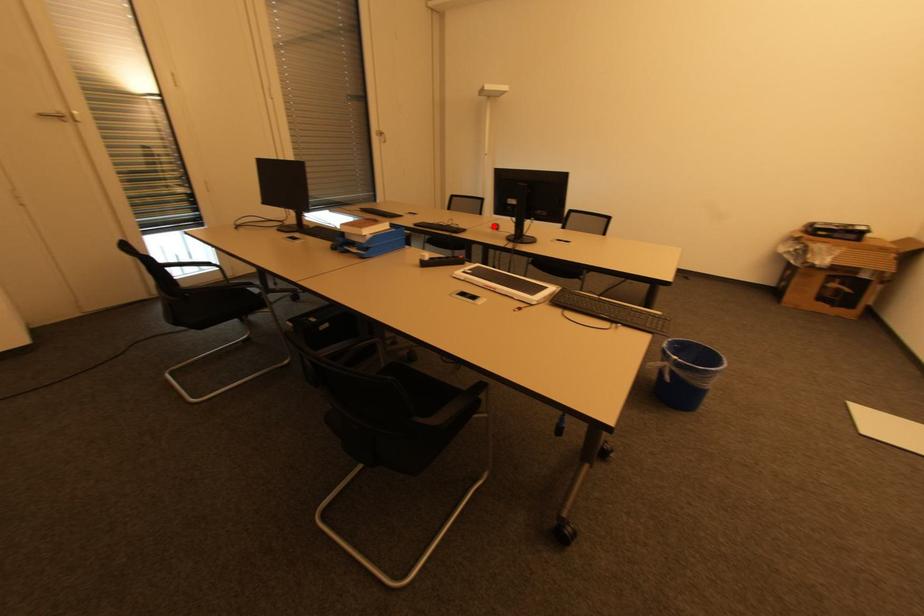
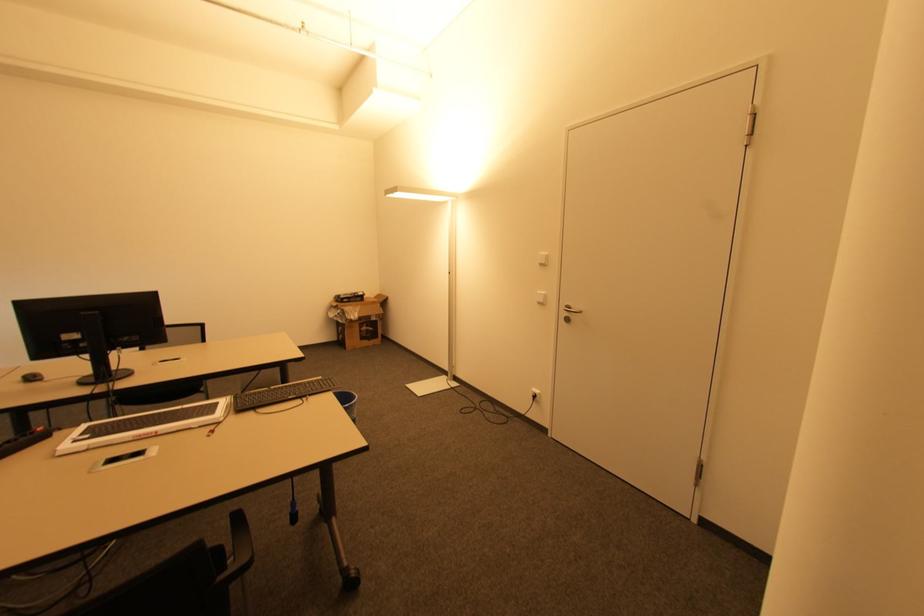
In the second image, find the point that corresponds to the highlighted location in the first image.

(21, 379)